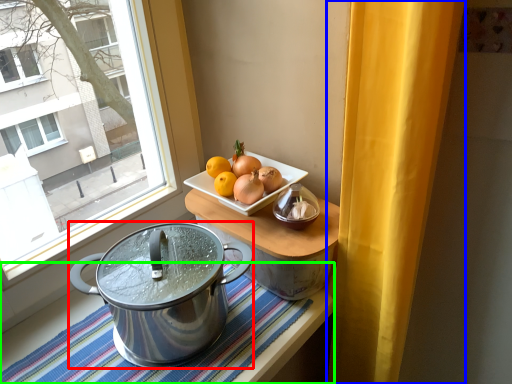
Question: Based on their relative distances, which object is nearer to kitchen appliance (highlighted by a red box)? Choose from curtain (highlighted by a blue box) and tablecloth (highlighted by a green box).

Choices:
 (A) curtain
 (B) tablecloth

Answer: (B)